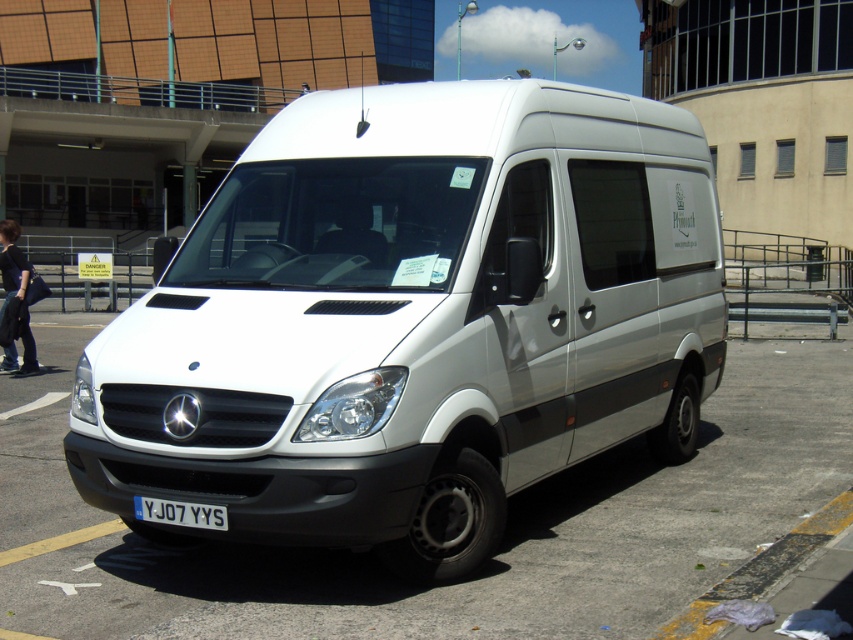
You are a delivery driver who needs to park your white matte van at center as close as possible to the yellow asphalt curb at lower right. Based on the scene, can you park the van so that it is entirely to the right of the curb?

The white matte van at center is already positioned to the left of the yellow asphalt curb at lower right. Since the van is already to the left of the curb, it cannot be parked entirely to the right of it without moving past the curb, which might not be allowed in a parking area. Therefore, the van cannot be parked entirely to the right of the yellow asphalt curb at lower right.

You are a delivery driver who needs to back up the van to load packages. The license plate must be visible at all times for security. Is the white plastic license plate at center visible while backing up the white metallic van at center?

The white metallic van at center is in front of the white plastic license plate at center, so when backing up, the van will block the view of the license plate. Therefore, the license plate will not be visible while backing up the van.

You are a delivery driver who needs to park your white matte van at center as close as possible to the yellow asphalt curb at lower right without going over the curb. Given that your van is 2 meters wide, is there enough space between the van and the curb to safely park?

The distance between the white matte van at center and the yellow asphalt curb at lower right is 2.16 meters. Since the van is 2 meters wide, there is sufficient space to park safely without exceeding the curb.